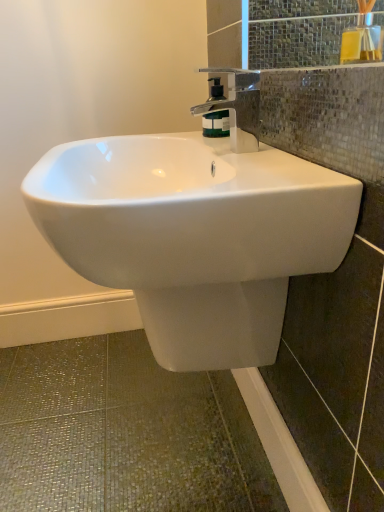
Question: Is white glossy sink at center smaller than polished chrome faucet at upper center?

Choices:
 (A) no
 (B) yes

Answer: (A)

Question: Is white glossy sink at center outside of polished chrome faucet at upper center?

Choices:
 (A) no
 (B) yes

Answer: (B)

Question: From a real-world perspective, is white glossy sink at center beneath polished chrome faucet at upper center?

Choices:
 (A) no
 (B) yes

Answer: (B)

Question: Are white glossy sink at center and polished chrome faucet at upper center far apart?

Choices:
 (A) no
 (B) yes

Answer: (A)

Question: From the image's perspective, is white glossy sink at center on polished chrome faucet at upper center?

Choices:
 (A) yes
 (B) no

Answer: (B)

Question: Is white glossy sink at center wider than polished chrome faucet at upper center?

Choices:
 (A) yes
 (B) no

Answer: (A)

Question: Is the depth of yellow glass bottle at upper right less than that of white glossy sink at center?

Choices:
 (A) yes
 (B) no

Answer: (B)

Question: Is yellow glass bottle at upper right aimed at white glossy sink at center?

Choices:
 (A) yes
 (B) no

Answer: (B)

Question: Is yellow glass bottle at upper right touching white glossy sink at center?

Choices:
 (A) yes
 (B) no

Answer: (B)

Question: Can you confirm if yellow glass bottle at upper right is wider than white glossy sink at center?

Choices:
 (A) yes
 (B) no

Answer: (B)

Question: Considering the relative sizes of yellow glass bottle at upper right and white glossy sink at center in the image provided, is yellow glass bottle at upper right taller than white glossy sink at center?

Choices:
 (A) no
 (B) yes

Answer: (A)

Question: Is yellow glass bottle at upper right not close to white glossy sink at center?

Choices:
 (A) no
 (B) yes

Answer: (A)

Question: Is the depth of yellow glass bottle at upper right greater than that of green matte soap dispenser at center?

Choices:
 (A) yes
 (B) no

Answer: (B)